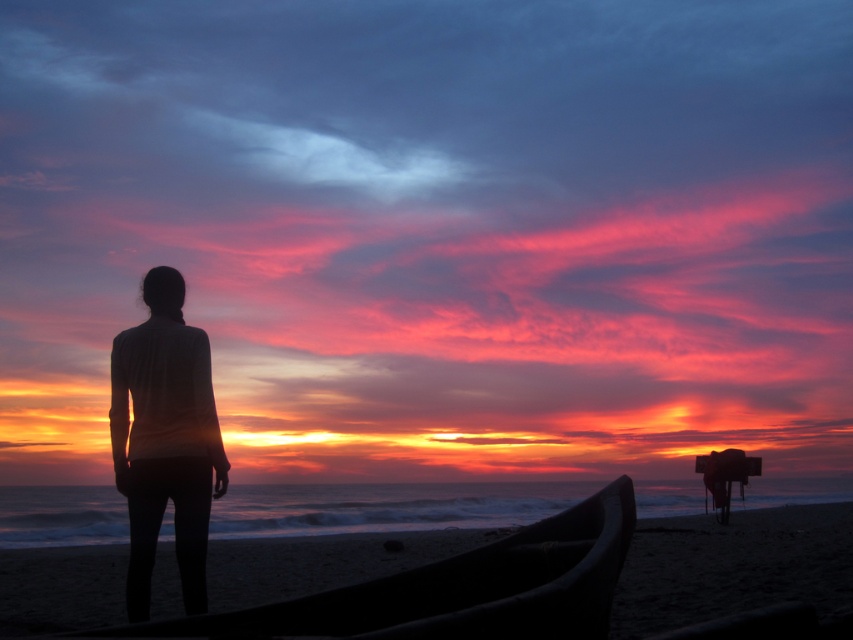
In the scene shown: Does smooth sand at lower left come in front of silhouette fabric at left?

No, it is not.

This screenshot has width=853, height=640. Describe the element at coordinates (732, 566) in the screenshot. I see `smooth sand at lower left` at that location.

You are a GUI agent. You are given a task and a screenshot of the screen. Output one action in this format:
    pyautogui.click(x=<x>, y=<y>)
    Task: Click on the smooth sand at lower left
    
    Given the screenshot: What is the action you would take?
    pyautogui.click(x=732, y=566)